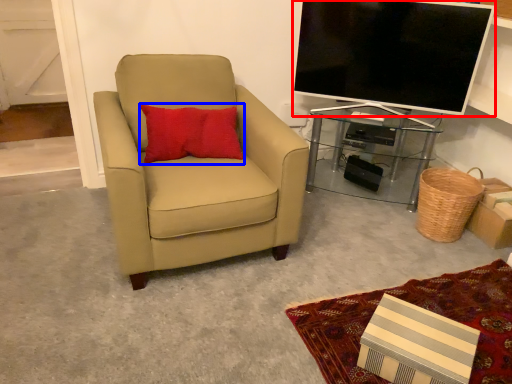
Question: Which object appears farthest to the camera in this image, television (highlighted by a red box) or pillow (highlighted by a blue box)?

Choices:
 (A) television
 (B) pillow

Answer: (A)